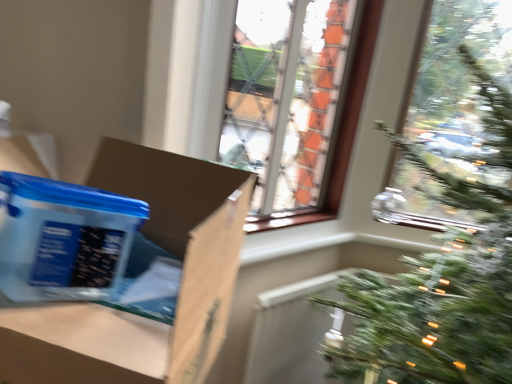
Question: From a real-world perspective, is translucent plastic container at left, placed as the 2th cardboard box when sorted from front to back, beneath matte brown cardboard at left, positioned as the 1th cardboard box in front-to-back order?

Choices:
 (A) yes
 (B) no

Answer: (B)

Question: Is matte brown cardboard at left, positioned as the 1th cardboard box in front-to-back order, at the back of translucent plastic container at left, placed as the 2th cardboard box when sorted from front to back?

Choices:
 (A) no
 (B) yes

Answer: (B)

Question: Is translucent plastic container at left, the first cardboard box viewed from the back, far away from matte brown cardboard at left, positioned as the 1th cardboard box in front-to-back order?

Choices:
 (A) yes
 (B) no

Answer: (B)

Question: Is translucent plastic container at left, placed as the 2th cardboard box when sorted from front to back, smaller than matte brown cardboard at left, marked as the second cardboard box in a back-to-front arrangement?

Choices:
 (A) yes
 (B) no

Answer: (A)

Question: From the image's perspective, is translucent plastic container at left, placed as the 2th cardboard box when sorted from front to back, located beneath matte brown cardboard at left, positioned as the 1th cardboard box in front-to-back order?

Choices:
 (A) yes
 (B) no

Answer: (B)

Question: Is translucent plastic container at left, the first cardboard box viewed from the back, positioned in front of matte brown cardboard at left, marked as the second cardboard box in a back-to-front arrangement?

Choices:
 (A) yes
 (B) no

Answer: (B)

Question: Can you confirm if matte brown cardboard at left, marked as the second cardboard box in a back-to-front arrangement, is bigger than translucent plastic container at left, placed as the 2th cardboard box when sorted from front to back?

Choices:
 (A) yes
 (B) no

Answer: (A)

Question: Would you consider matte brown cardboard at left, positioned as the 1th cardboard box in front-to-back order, to be distant from translucent plastic container at left, placed as the 2th cardboard box when sorted from front to back?

Choices:
 (A) yes
 (B) no

Answer: (B)

Question: Is matte brown cardboard at left, positioned as the 1th cardboard box in front-to-back order, taller than translucent plastic container at left, the first cardboard box viewed from the back?

Choices:
 (A) no
 (B) yes

Answer: (B)

Question: Is matte brown cardboard at left, marked as the second cardboard box in a back-to-front arrangement, not inside translucent plastic container at left, placed as the 2th cardboard box when sorted from front to back?

Choices:
 (A) no
 (B) yes

Answer: (B)

Question: Does matte brown cardboard at left, marked as the second cardboard box in a back-to-front arrangement, lie in front of translucent plastic container at left, the first cardboard box viewed from the back?

Choices:
 (A) yes
 (B) no

Answer: (A)

Question: Are matte brown cardboard at left, positioned as the 1th cardboard box in front-to-back order, and translucent plastic container at left, placed as the 2th cardboard box when sorted from front to back, making contact?

Choices:
 (A) yes
 (B) no

Answer: (B)

Question: Is translucent plastic container at left, the first cardboard box viewed from the back, to the left or to the right of matte brown cardboard at left, marked as the second cardboard box in a back-to-front arrangement, in the image?

Choices:
 (A) right
 (B) left

Answer: (B)